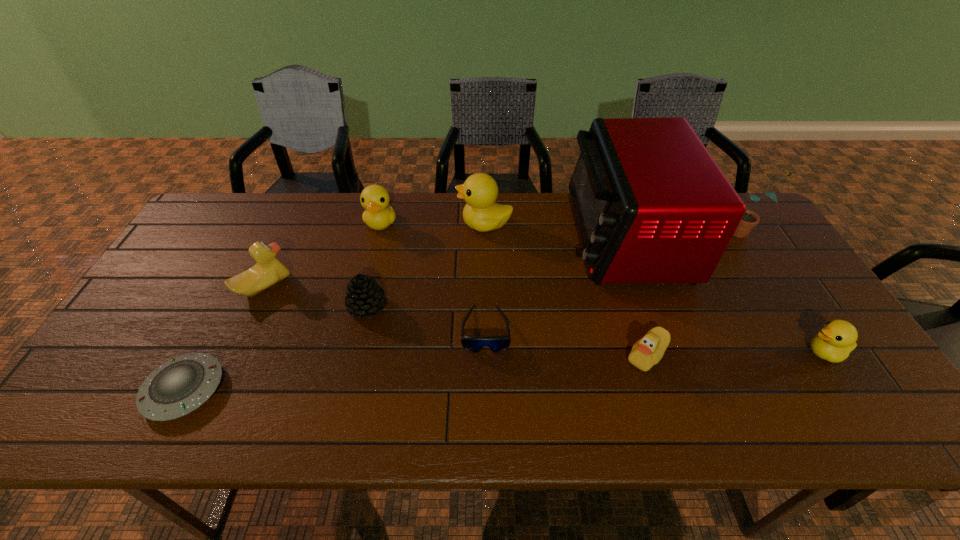
Identify the location of the nearest yellow duck. (837, 338).

Find the location of `the smallest yellow duck`. the smallest yellow duck is located at coordinates (837, 338).

What are the coordinates of `the nearer beige duck` in the screenshot? It's located at (648, 351).

Locate an element on the screen. The height and width of the screenshot is (540, 960). the smaller beige duck is located at coordinates (648, 351).

I want to click on blue sunglasses, so click(x=474, y=344).

This screenshot has height=540, width=960. Find the location of `sunglasses`. sunglasses is located at coordinates (474, 344).

The height and width of the screenshot is (540, 960). I want to click on saucer, so click(179, 386).

Image resolution: width=960 pixels, height=540 pixels. Identify the location of vacant space situated on the front-facing side of the toaster oven. (543, 236).

The width and height of the screenshot is (960, 540). I want to click on vacant space situated 0.210m on the front-facing side of the toaster oven, so click(502, 236).

The image size is (960, 540). Identify the location of free space located on the front-facing side of the toaster oven. (499, 236).